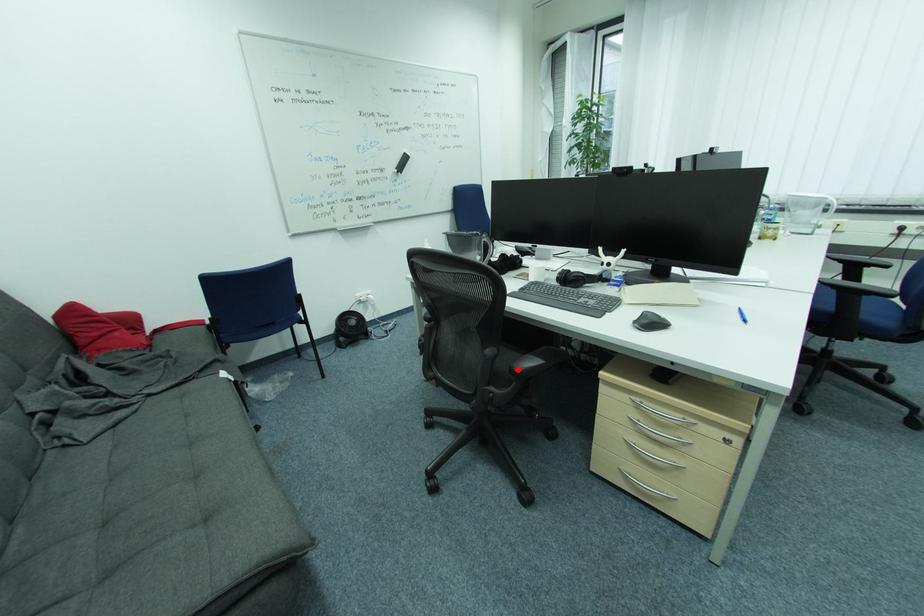
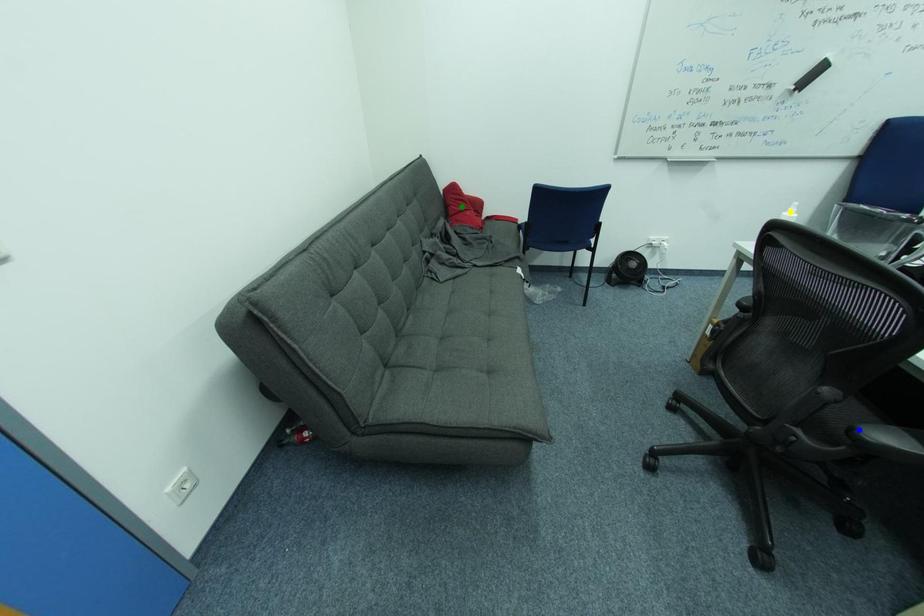
Question: I am providing you with two images of the same scene from different viewpoints. A red point is marked on the first image. You are given multiple points on the second image. Which point in image 2 is actually the same real-world point as the red point in image 1?

Choices:
 (A) blue point
 (B) yellow point
 (C) green point

Answer: (A)